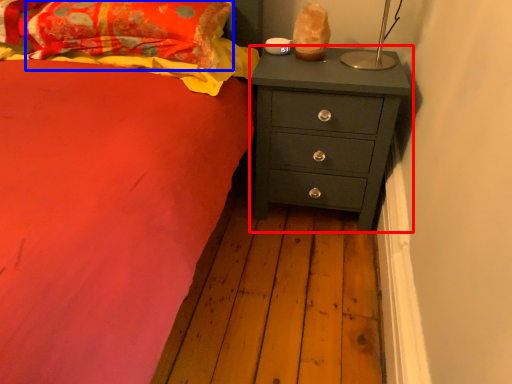
Question: Which object is further to the camera taking this photo, chest of drawers (highlighted by a red box) or pillow (highlighted by a blue box)?

Choices:
 (A) chest of drawers
 (B) pillow

Answer: (A)